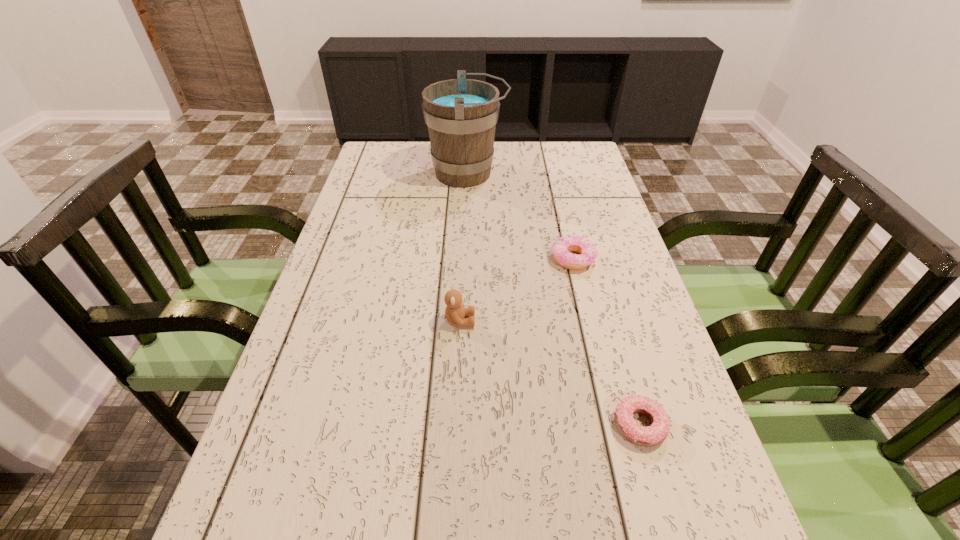
You are a GUI agent. You are given a task and a screenshot of the screen. Output one action in this format:
    pyautogui.click(x=<x>, y=<y>)
    Task: Click on the vacant area that lies between the farther doughnut and the tallest object
    This screenshot has height=540, width=960.
    Given the screenshot: What is the action you would take?
    pyautogui.click(x=520, y=216)

You are a GUI agent. You are given a task and a screenshot of the screen. Output one action in this format:
    pyautogui.click(x=<x>, y=<y>)
    Task: Click on the free space between the third tallest object and the nearer doughnut
    This screenshot has width=960, height=540.
    Given the screenshot: What is the action you would take?
    pyautogui.click(x=607, y=342)

Image resolution: width=960 pixels, height=540 pixels. Identify the location of empty location between the shorter doughnut and the farthest object. (554, 299).

At what (x,y) coordinates should I click in order to perform the action: click on free space between the wine bucket and the shortest object. Please return your answer as a coordinate pair (x, y). Looking at the image, I should click on (554, 299).

At what (x,y) coordinates should I click in order to perform the action: click on empty location between the teddy bear and the farthest object. Please return your answer as a coordinate pair (x, y). The width and height of the screenshot is (960, 540). Looking at the image, I should click on (464, 247).

Where is `free spot between the taller doughnut and the nearest object`? free spot between the taller doughnut and the nearest object is located at coordinates (607, 342).

At what (x,y) coordinates should I click in order to perform the action: click on blank region between the nearer doughnut and the third tallest object. Please return your answer as a coordinate pair (x, y). The image size is (960, 540). Looking at the image, I should click on (607, 342).

Point out which object is positioned as the nearest to the tallest object. Please provide its 2D coordinates. Your answer should be formatted as a tuple, i.e. [(x, y)], where the tuple contains the x and y coordinates of a point satisfying the conditions above.

[(561, 247)]

Image resolution: width=960 pixels, height=540 pixels. I want to click on the second closest object to the third tallest object, so click(x=461, y=114).

Locate an element on the screen. vacant space that satisfies the following two spatial constraints: 1. with a handle on the side of the tallest object; 2. on the back side of the farther doughnut is located at coordinates (464, 259).